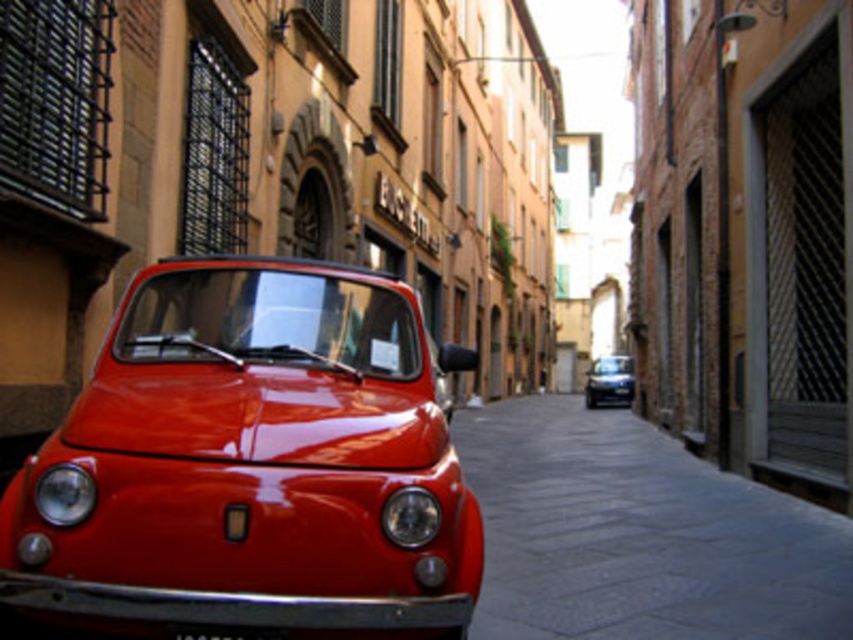
Who is shorter, dark gray stone alley at center or shiny black car at center?

With less height is dark gray stone alley at center.

Is point (553, 618) farther from viewer compared to point (585, 378)?

No.

Consider the image. Measure the distance between dark gray stone alley at center and camera.

dark gray stone alley at center is 10.28 feet away from camera.

You are a GUI agent. You are given a task and a screenshot of the screen. Output one action in this format:
    pyautogui.click(x=<x>, y=<y>)
    Task: Click on the dark gray stone alley at center
    Image resolution: width=853 pixels, height=640 pixels.
    Given the screenshot: What is the action you would take?
    pyautogui.click(x=639, y=534)

This screenshot has height=640, width=853. Find the location of `glossy red car at center`. glossy red car at center is located at coordinates (250, 467).

Is glossy red car at center positioned behind black plastic license plate at center?

Yes, it is.

Who is more distant from viewer, (390, 291) or (219, 628)?

Point (390, 291)

At what (x,y) coordinates should I click in order to perform the action: click on glossy red car at center. Please return your answer as a coordinate pair (x, y). This screenshot has height=640, width=853. Looking at the image, I should click on (250, 467).

Can you confirm if dark gray stone alley at center is wider than black plastic license plate at center?

Indeed, dark gray stone alley at center has a greater width compared to black plastic license plate at center.

Does dark gray stone alley at center come in front of black plastic license plate at center?

No, it is behind black plastic license plate at center.

Is point (671, 449) positioned before point (276, 634)?

No, (671, 449) is further to viewer.

Identify the location of dark gray stone alley at center. The image size is (853, 640). (639, 534).